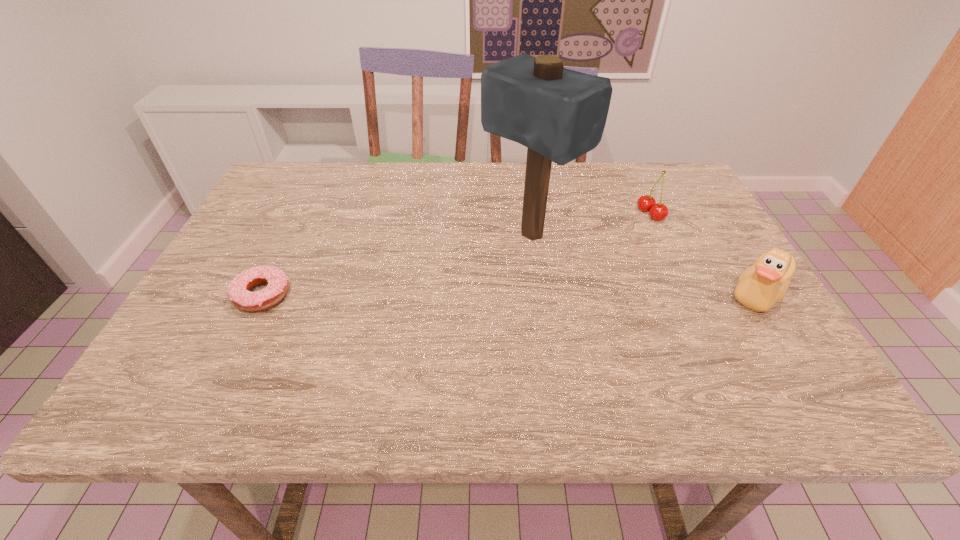
The image size is (960, 540). What are the coordinates of `the shortest object` in the screenshot? It's located at (239, 292).

The width and height of the screenshot is (960, 540). In order to click on doughnut in this screenshot , I will do `click(239, 292)`.

Identify the location of the rightmost object. (760, 286).

Identify the location of the second object from right to left. (646, 203).

What are the coordinates of `the tallest object` in the screenshot? It's located at (559, 114).

You are a GUI agent. You are given a task and a screenshot of the screen. Output one action in this format:
    pyautogui.click(x=<x>, y=<y>)
    Task: Click on the mallet
    The image size is (960, 540).
    Given the screenshot: What is the action you would take?
    pyautogui.click(x=559, y=114)

Where is `vacant space located on the right of the shortest object`? The image size is (960, 540). vacant space located on the right of the shortest object is located at coordinates (313, 295).

Identify the location of free space located 0.180m at the beak of the duck. (643, 293).

Identify the location of vacant space positioned 0.080m at the beak of the duck. The image size is (960, 540). (688, 293).

Locate an element on the screen. free space located 0.120m at the beak of the duck is located at coordinates (670, 293).